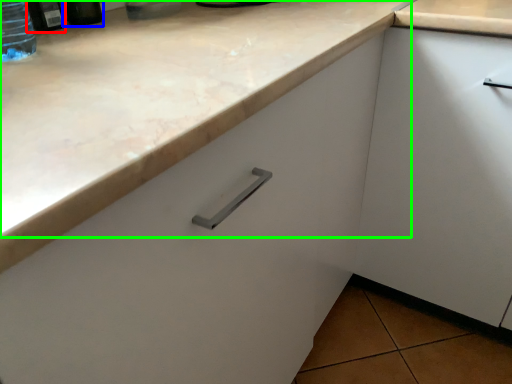
Question: Estimate the real-world distances between objects in this image. Which object is closer to bottle (highlighted by a red box), bottle (highlighted by a blue box) or counter top (highlighted by a green box)?

Choices:
 (A) bottle
 (B) counter top

Answer: (A)